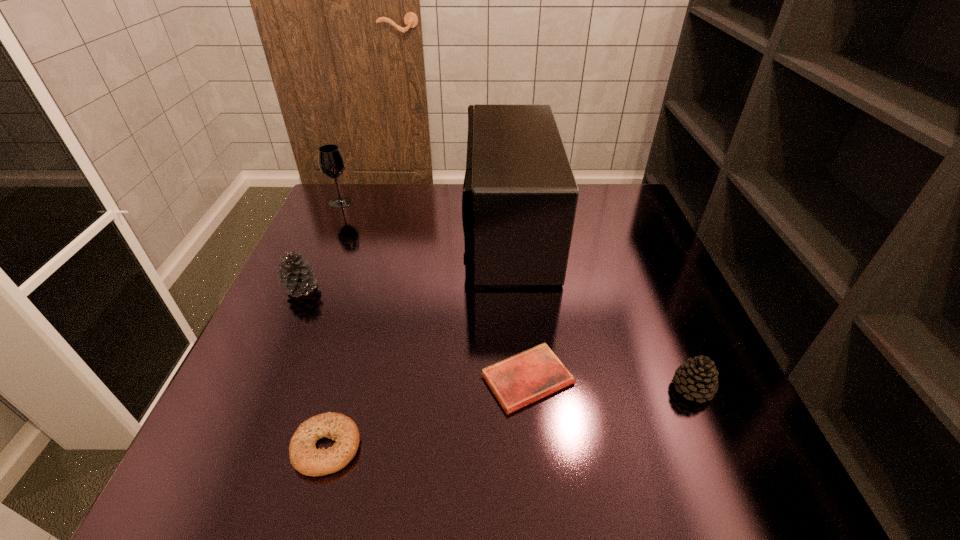
Find the location of a particular element. The width and height of the screenshot is (960, 540). wineglass present at the left edge is located at coordinates (331, 162).

At what (x,y) coordinates should I click in order to perform the action: click on pinecone that is at the left edge. Please return your answer as a coordinate pair (x, y). Looking at the image, I should click on (296, 277).

This screenshot has height=540, width=960. I want to click on bagel that is at the left edge, so click(304, 456).

This screenshot has width=960, height=540. I want to click on object that is at the right edge, so click(697, 378).

This screenshot has width=960, height=540. I want to click on object present at the far left corner, so click(331, 162).

What are the coordinates of `object at the near left corner` in the screenshot? It's located at (304, 456).

In the image, there is a desktop. Identify the location of vacant space at the far edge. This screenshot has width=960, height=540. (435, 184).

In the image, there is a desktop. At what (x,y) coordinates should I click in order to perform the action: click on free space at the near edge. Please return your answer as a coordinate pair (x, y). Image resolution: width=960 pixels, height=540 pixels. Looking at the image, I should click on (464, 449).

In order to click on vacant area at the left edge of the desktop in this screenshot , I will do `click(350, 284)`.

Locate an element on the screen. The width and height of the screenshot is (960, 540). vacant space at the right edge of the desktop is located at coordinates (657, 286).